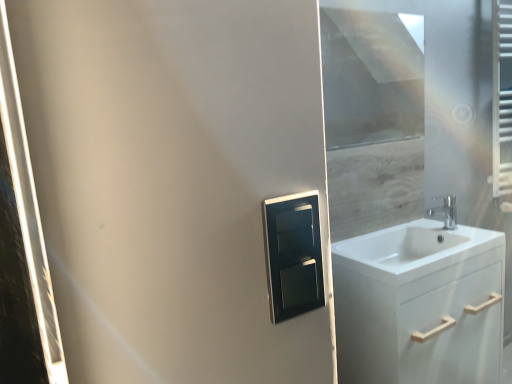
Image resolution: width=512 pixels, height=384 pixels. Identify the location of transparent glass window screen at upper right. (370, 78).

Locate an element on the screen. satin black medicine cabinet at center is located at coordinates (293, 255).

Locate an element on the screen. The image size is (512, 384). white glossy sink at right is located at coordinates (412, 249).

Does white matte cabinet at right have a larger size compared to transparent glass window screen at upper right?

Yes, white matte cabinet at right is bigger than transparent glass window screen at upper right.

Identify the location of bathroom cabinet in front of the transparent glass window screen at upper right. (420, 304).

From a real-world perspective, is white matte cabinet at right positioned above or below transparent glass window screen at upper right?

Clearly, from a real-world perspective, white matte cabinet at right is below transparent glass window screen at upper right.

Which is more to the left, white glossy sink at right or chrome metallic faucet at right?

white glossy sink at right is more to the left.

From the picture: Is the position of white glossy sink at right more distant than that of chrome metallic faucet at right?

No, it is in front of chrome metallic faucet at right.

Based on the photo, does white glossy sink at right touch chrome metallic faucet at right?

No, white glossy sink at right is not beside chrome metallic faucet at right.

Is chrome metallic faucet at right completely or partially inside white glossy sink at right?

No.

Is transparent glass window screen at upper right beside white matte cabinet at right?

No.

Does point (362, 98) lie behind point (456, 355)?

Yes, it is behind point (456, 355).

Does transparent glass window screen at upper right turn towards white matte cabinet at right?

No, transparent glass window screen at upper right is not aimed at white matte cabinet at right.

From a real-world perspective, is white glossy sink at right positioned above or below transparent glass window screen at upper right?

white glossy sink at right is situated lower than transparent glass window screen at upper right in the real world.

From their relative heights in the image, would you say white glossy sink at right is taller or shorter than transparent glass window screen at upper right?

Clearly, white glossy sink at right is shorter compared to transparent glass window screen at upper right.

From the picture: How many degrees apart are the facing directions of white glossy sink at right and transparent glass window screen at upper right?

The angular difference between white glossy sink at right and transparent glass window screen at upper right is 2.35 degrees.

Does point (402, 263) lie in front of point (399, 96)?

Yes, it is.

Considering the sizes of objects white matte cabinet at right and white glossy sink at right in the image provided, who is thinner, white matte cabinet at right or white glossy sink at right?

Thinner between the two is white glossy sink at right.

From a real-world perspective, between white matte cabinet at right and white glossy sink at right, who is vertically lower?

white matte cabinet at right, from a real-world perspective.

Would you say white matte cabinet at right is inside or outside white glossy sink at right?

white matte cabinet at right is spatially situated outside white glossy sink at right.

Is white matte cabinet at right closer to camera compared to white glossy sink at right?

Yes, white matte cabinet at right is in front of white glossy sink at right.

From the picture: Based on their positions, is transparent glass window screen at upper right located to the left or right of white glossy sink at right?

Clearly, transparent glass window screen at upper right is on the left of white glossy sink at right in the image.

Is transparent glass window screen at upper right next to white glossy sink at right and touching it?

No, transparent glass window screen at upper right is not in contact with white glossy sink at right.

Can you tell me how much transparent glass window screen at upper right and white glossy sink at right differ in facing direction?

They differ by 2.35 degrees in their facing directions.

Is satin black medicine cabinet at center a part of chrome metallic faucet at right?

No.

This screenshot has width=512, height=384. I want to click on medicine cabinet that is above the chrome metallic faucet at right (from a real-world perspective), so pos(293,255).

Is point (448, 207) closer or farther from the camera than point (314, 302)?

Point (448, 207) is positioned farther from the camera compared to point (314, 302).

Who is taller, chrome metallic faucet at right or satin black medicine cabinet at center?

satin black medicine cabinet at center.

Locate an element on the screen. The height and width of the screenshot is (384, 512). bathroom cabinet in front of the transparent glass window screen at upper right is located at coordinates (420, 304).

Identify the location of tap that appears above the white glossy sink at right (from the image's perspective). (446, 211).

Looking at the image, which one is located closer to transparent glass window screen at upper right, chrome metallic faucet at right or white matte cabinet at right?

chrome metallic faucet at right is closer to transparent glass window screen at upper right.

Looking at the image, which one is located closer to satin black medicine cabinet at center, chrome metallic faucet at right or transparent glass window screen at upper right?

The object closer to satin black medicine cabinet at center is chrome metallic faucet at right.

Looking at this image, based on their spatial positions, is white matte cabinet at right or white glossy sink at right further from chrome metallic faucet at right?

white matte cabinet at right is further to chrome metallic faucet at right.

Which object lies further to the anchor point white matte cabinet at right, satin black medicine cabinet at center or transparent glass window screen at upper right?

transparent glass window screen at upper right is further to white matte cabinet at right.

From the picture: Estimate the real-world distances between objects in this image. Which object is further from transparent glass window screen at upper right, white matte cabinet at right or white glossy sink at right?

The object further to transparent glass window screen at upper right is white matte cabinet at right.

Considering their positions, is satin black medicine cabinet at center positioned closer to chrome metallic faucet at right than white glossy sink at right?

white glossy sink at right.

Estimate the real-world distances between objects in this image. Which object is closer to white glossy sink at right, chrome metallic faucet at right or white matte cabinet at right?

Based on the image, white matte cabinet at right appears to be nearer to white glossy sink at right.

Looking at the image, which one is located further to satin black medicine cabinet at center, chrome metallic faucet at right or white glossy sink at right?

The object further to satin black medicine cabinet at center is chrome metallic faucet at right.

Identify the location of sink between satin black medicine cabinet at center and chrome metallic faucet at right in the front-back direction. (412, 249).

In order to click on medicine cabinet between transparent glass window screen at upper right and white matte cabinet at right in the up-down direction in this screenshot , I will do `click(293, 255)`.

What are the coordinates of `sink between satin black medicine cabinet at center and transparent glass window screen at upper right from front to back` in the screenshot? It's located at (412, 249).

In order to click on bathroom cabinet positioned between satin black medicine cabinet at center and white glossy sink at right from near to far in this screenshot , I will do `click(420, 304)`.